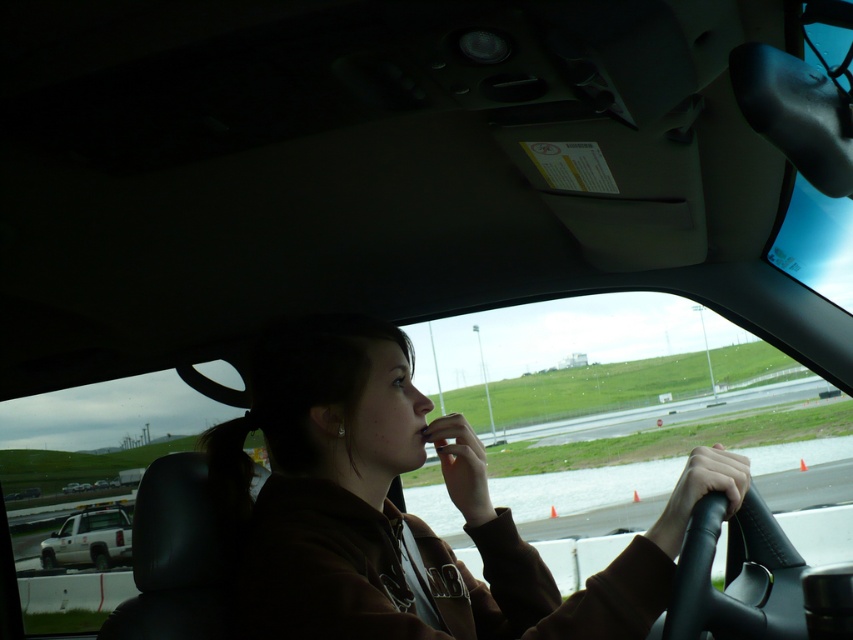
You are a passenger in the car and want to hand the driver the white matte truck at lower left, which is on the seat. The brown cotton jacket at center is in the way. Can you move the jacket to reach the truck?

The brown cotton jacket at center is closer to the viewer than the white matte truck at lower left, so moving the jacket would allow access to the truck.

You are a passenger in the car and need to hand a small item to the driver. The driver is wearing the brown cotton jacket at center, and there is a white matte truck at lower left. Which object is closer to the driver, and why?

The brown cotton jacket at center is closer to the driver because it is taller than the white matte truck at lower left, indicating it is positioned nearer in the driver area.

You are a passenger in the car and need to place a small item on the dashboard. The brown cotton jacket at center and the white matte truck at lower left are both visible. Which object should you choose to place the item on if you want it to be more stable?

The brown cotton jacket at center is larger in size than the white matte truck at lower left, so placing the item on the brown cotton jacket at center would provide a more stable surface due to its larger surface area.